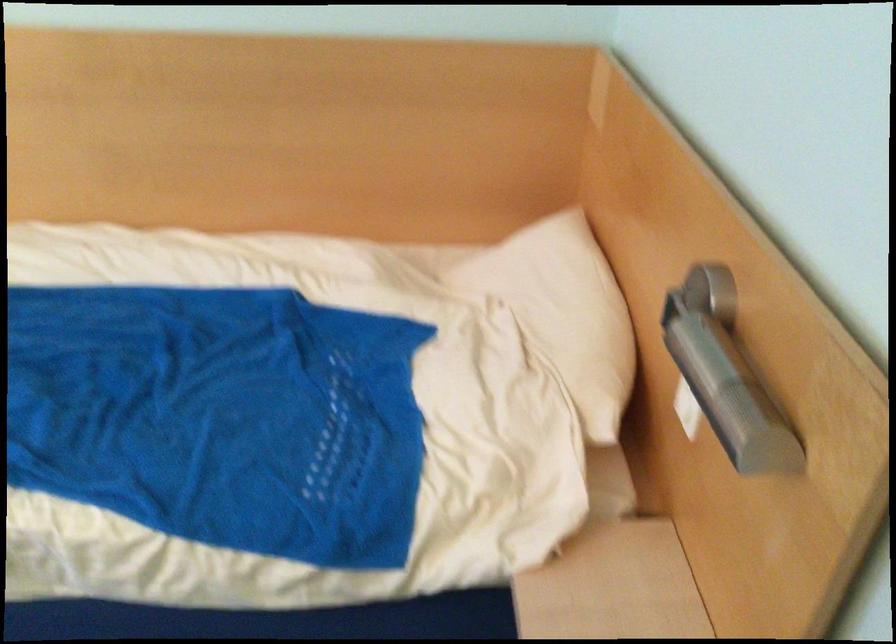
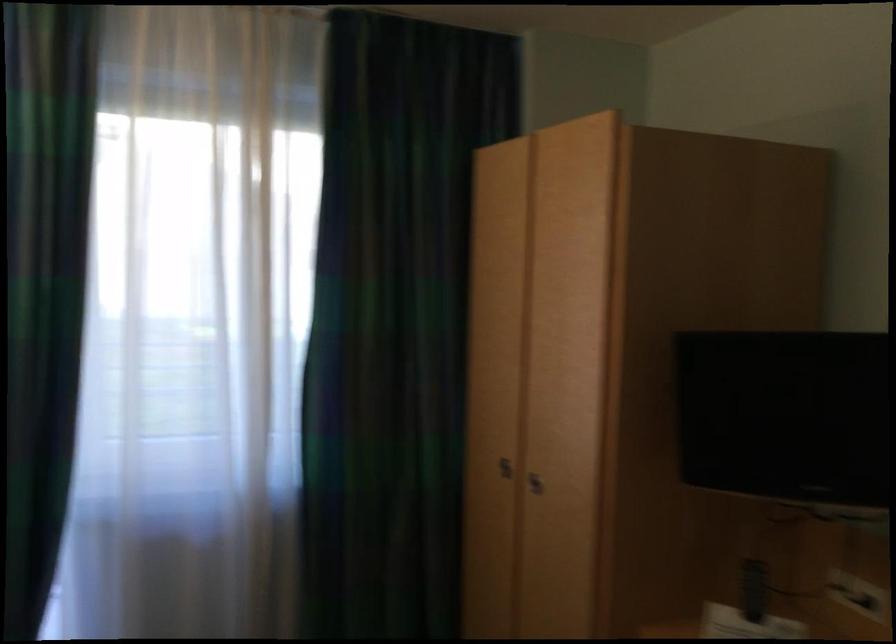
Question: The first image is from the beginning of the video and the second image is from the end. How did the camera likely rotate when shooting the video?

Choices:
 (A) Left
 (B) Right
 (C) Up
 (D) Down

Answer: (A)